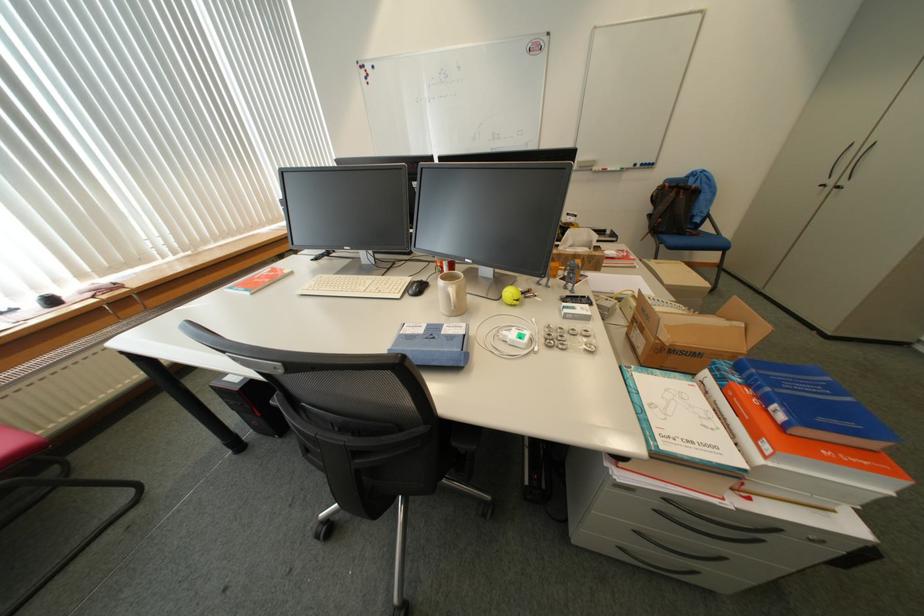
The image size is (924, 616). I want to click on beige mug handle, so click(452, 293).